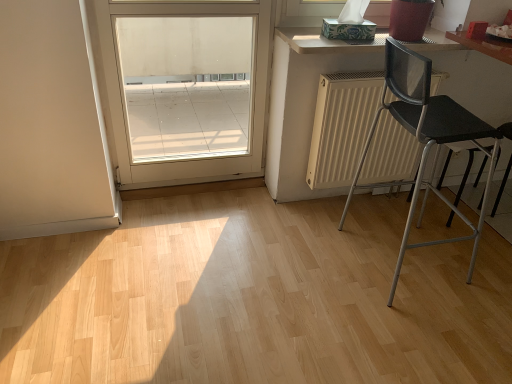
At what (x,y) coordinates should I click in order to perform the action: click on vacant space to the left of black mesh chair at right. Please return your answer as a coordinate pair (x, y). Image resolution: width=512 pixels, height=384 pixels. Looking at the image, I should click on (309, 260).